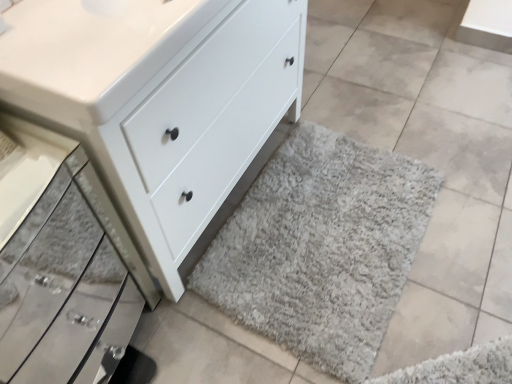
Question: Is gray shaggy rug at lower right facing towards white matte chest of drawers at lower center?

Choices:
 (A) yes
 (B) no

Answer: (B)

Question: Considering the relative positions of gray shaggy rug at lower right and white matte chest of drawers at lower center in the image provided, is gray shaggy rug at lower right behind white matte chest of drawers at lower center?

Choices:
 (A) no
 (B) yes

Answer: (B)

Question: Is gray shaggy rug at lower right to the right of white matte chest of drawers at lower center from the viewer's perspective?

Choices:
 (A) no
 (B) yes

Answer: (B)

Question: Is gray shaggy rug at lower right turned away from white matte chest of drawers at lower center?

Choices:
 (A) no
 (B) yes

Answer: (B)

Question: From the image's perspective, is gray shaggy rug at lower right on top of white matte chest of drawers at lower center?

Choices:
 (A) no
 (B) yes

Answer: (A)

Question: From a real-world perspective, is gray shaggy rug at lower right positioned over white matte chest of drawers at lower center based on gravity?

Choices:
 (A) yes
 (B) no

Answer: (B)

Question: Considering the relative sizes of gray shaggy rug at lower right and satin silver drawer at lower left in the image provided, is gray shaggy rug at lower right wider than satin silver drawer at lower left?

Choices:
 (A) yes
 (B) no

Answer: (A)

Question: From the image's perspective, is gray shaggy rug at lower right below satin silver drawer at lower left?

Choices:
 (A) no
 (B) yes

Answer: (A)

Question: From a real-world perspective, is gray shaggy rug at lower right beneath satin silver drawer at lower left?

Choices:
 (A) no
 (B) yes

Answer: (B)

Question: Is gray shaggy rug at lower right to the left of satin silver drawer at lower left from the viewer's perspective?

Choices:
 (A) no
 (B) yes

Answer: (A)

Question: Can you confirm if gray shaggy rug at lower right is thinner than satin silver drawer at lower left?

Choices:
 (A) no
 (B) yes

Answer: (A)

Question: Is gray shaggy rug at lower right positioned with its back to satin silver drawer at lower left?

Choices:
 (A) no
 (B) yes

Answer: (A)

Question: Does white glossy sink at upper left have a smaller size compared to gray shaggy rug at lower right?

Choices:
 (A) yes
 (B) no

Answer: (A)